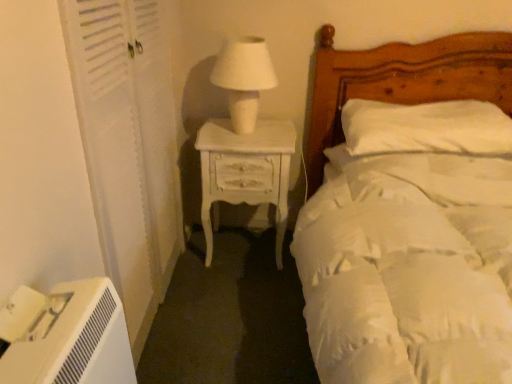
Question: From the image's perspective, is white matte table lamp at center located above or below white painted wood nightstand at center left?

Choices:
 (A) below
 (B) above

Answer: (B)

Question: Relative to white painted wood nightstand at center left, is white matte table lamp at center in front or behind?

Choices:
 (A) front
 (B) behind

Answer: (A)

Question: Considering the real-world distances, which object is farthest from the white soft pillow at upper right?

Choices:
 (A) white wooden screen door at left
 (B) white matte table lamp at center
 (C) white soft bed at upper right
 (D) white painted wood nightstand at center left

Answer: (A)

Question: Estimate the real-world distances between objects in this image. Which object is farther from the white soft bed at upper right?

Choices:
 (A) white painted wood nightstand at center left
 (B) white soft pillow at upper right
 (C) white wooden screen door at left
 (D) white matte table lamp at center

Answer: (C)